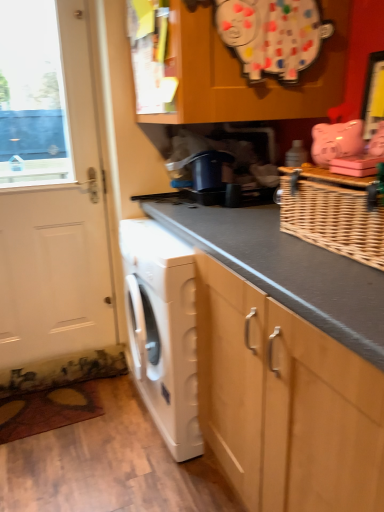
Question: Does woven brown basket at upper right appear on the left side of white matte washing machine at lower left?

Choices:
 (A) no
 (B) yes

Answer: (A)

Question: From the image's perspective, is woven brown basket at upper right below white matte washing machine at lower left?

Choices:
 (A) yes
 (B) no

Answer: (B)

Question: From the image's perspective, is woven brown basket at upper right on top of white matte washing machine at lower left?

Choices:
 (A) yes
 (B) no

Answer: (A)

Question: Is woven brown basket at upper right positioned in front of white matte washing machine at lower left?

Choices:
 (A) yes
 (B) no

Answer: (A)

Question: From a real-world perspective, is woven brown basket at upper right physically above white matte washing machine at lower left?

Choices:
 (A) no
 (B) yes

Answer: (B)

Question: From a real-world perspective, is woven brown basket at upper right physically located above or below white matte washing machine at lower left?

Choices:
 (A) below
 (B) above

Answer: (B)

Question: Is woven brown basket at upper right situated inside white matte washing machine at lower left or outside?

Choices:
 (A) outside
 (B) inside

Answer: (A)

Question: Considering the positions of woven brown basket at upper right and white matte washing machine at lower left in the image, is woven brown basket at upper right taller or shorter than white matte washing machine at lower left?

Choices:
 (A) short
 (B) tall

Answer: (A)

Question: From the image's perspective, relative to white matte washing machine at lower left, is woven brown basket at upper right above or below?

Choices:
 (A) below
 (B) above

Answer: (B)

Question: Is white matte door at left wider or thinner than woven brown basket at upper right?

Choices:
 (A) wide
 (B) thin

Answer: (B)

Question: Is white matte door at left situated inside woven brown basket at upper right or outside?

Choices:
 (A) outside
 (B) inside

Answer: (A)

Question: From a real-world perspective, is white matte door at left positioned above or below woven brown basket at upper right?

Choices:
 (A) above
 (B) below

Answer: (B)

Question: Visually, is white matte door at left positioned to the left or to the right of woven brown basket at upper right?

Choices:
 (A) right
 (B) left

Answer: (B)

Question: Considering the positions of point (350, 202) and point (84, 65), is point (350, 202) closer or farther from the camera than point (84, 65)?

Choices:
 (A) closer
 (B) farther

Answer: (A)

Question: Is woven brown basket at upper right taller or shorter than white matte door at left?

Choices:
 (A) short
 (B) tall

Answer: (A)